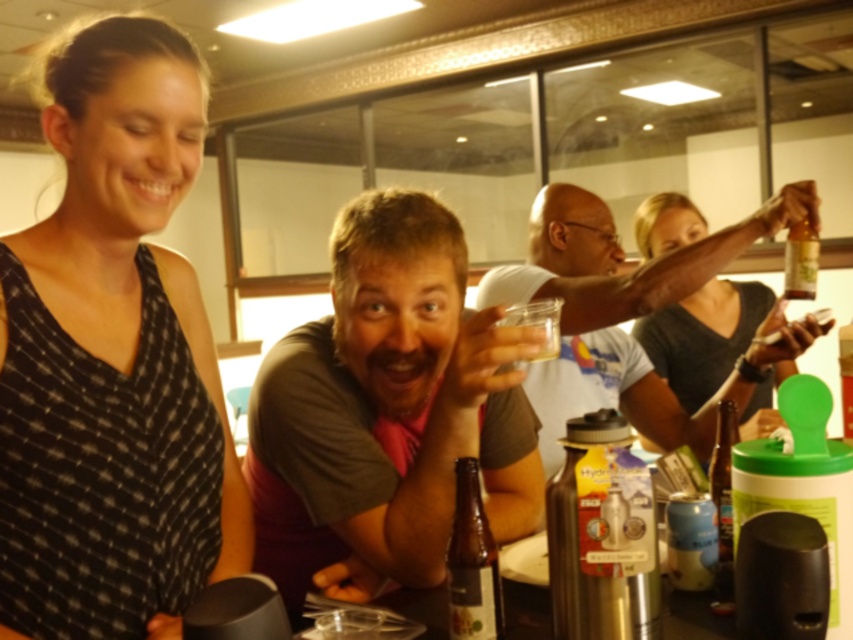
Does matte black arm at upper right appear on the right side of brown glass bottle at lower center?

Correct, you'll find matte black arm at upper right to the right of brown glass bottle at lower center.

Does matte black arm at upper right appear on the left side of brown glass bottle at lower center?

In fact, matte black arm at upper right is to the right of brown glass bottle at lower center.

The image size is (853, 640). In order to click on matte black arm at upper right in this screenshot , I will do `click(627, 314)`.

Does brown cotton shirt at center have a greater width compared to translucent glass bottle at upper right?

Indeed, brown cotton shirt at center has a greater width compared to translucent glass bottle at upper right.

Is brown cotton shirt at center to the right of translucent glass bottle at upper right from the viewer's perspective?

No, brown cotton shirt at center is not to the right of translucent glass bottle at upper right.

Does point (372, 524) come closer to viewer compared to point (816, 237)?

Yes, it is.

Identify the location of brown cotton shirt at center. The width and height of the screenshot is (853, 640). (387, 408).

Measure the distance from silver metallic thermos at lower center to brown glass bottle at lower center.

A distance of 10.40 centimeters exists between silver metallic thermos at lower center and brown glass bottle at lower center.

Based on the photo, which is below, silver metallic thermos at lower center or brown glass bottle at lower center?

brown glass bottle at lower center is below.

Which is in front, point (595, 612) or point (498, 586)?

Point (595, 612)

Locate an element on the screen. silver metallic thermos at lower center is located at coordinates (596, 531).